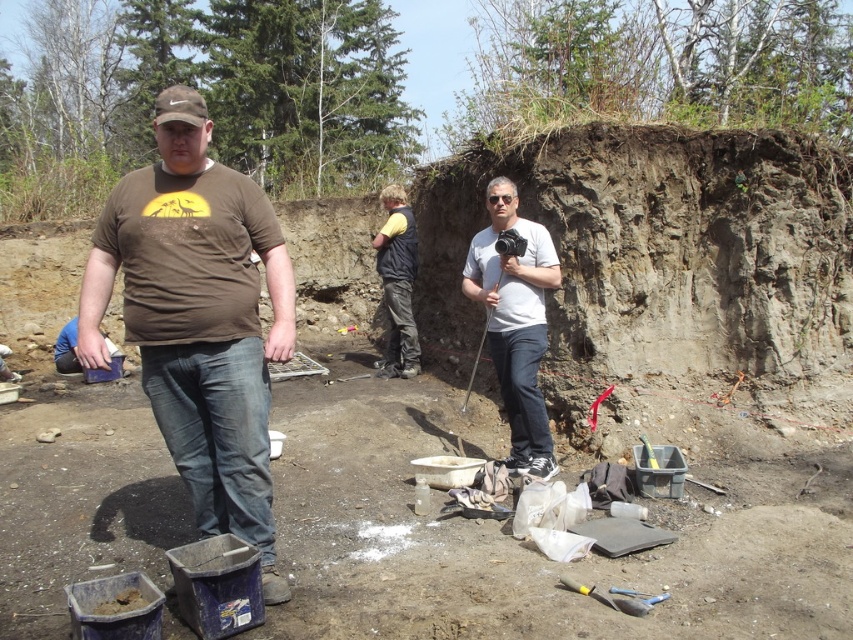
How much distance is there between white matte camera at center and yellow fabric vest at center?

white matte camera at center is 8.48 feet from yellow fabric vest at center.

Between point (535, 328) and point (402, 378), which one is positioned behind?

The point (402, 378) is behind.

This screenshot has width=853, height=640. Find the location of `white matte camera at center`. white matte camera at center is located at coordinates (515, 323).

This screenshot has height=640, width=853. What do you see at coordinates (198, 317) in the screenshot? I see `brown cotton t-shirt at left` at bounding box center [198, 317].

Which is more to the right, brown cotton t-shirt at left or white matte camera at center?

white matte camera at center

Between point (288, 278) and point (540, 326), which one is positioned behind?

Positioned behind is point (540, 326).

The height and width of the screenshot is (640, 853). Identify the location of brown cotton t-shirt at left. pos(198,317).

Who is more forward, [257,326] or [415,260]?

Point [257,326] is more forward.

Does brown cotton t-shirt at left have a lesser width compared to yellow fabric vest at center?

In fact, brown cotton t-shirt at left might be wider than yellow fabric vest at center.

This screenshot has height=640, width=853. What do you see at coordinates (198, 317) in the screenshot?
I see `brown cotton t-shirt at left` at bounding box center [198, 317].

I want to click on brown cotton t-shirt at left, so click(198, 317).